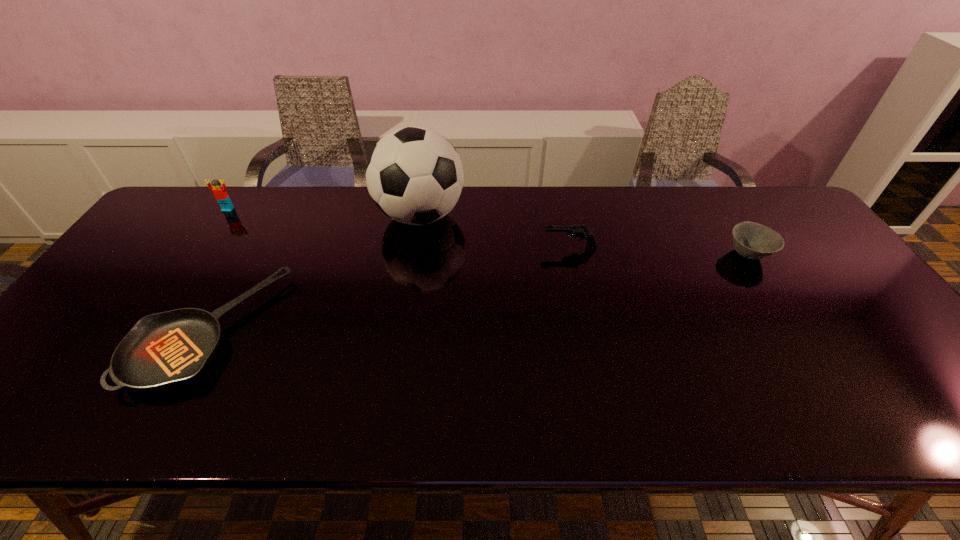
This screenshot has height=540, width=960. Identify the location of free location that satisfies the following two spatial constraints: 1. at the end of the barrel of the fourth tallest object; 2. on the right side of the gun. (571, 254).

The height and width of the screenshot is (540, 960). Identify the location of free space that satisfies the following two spatial constraints: 1. at the end of the barrel of the gun; 2. on the back side of the bowl. (x=571, y=254).

Find the location of a particular element. Image resolution: width=960 pixels, height=540 pixels. vacant space that satisfies the following two spatial constraints: 1. on the face of the Lego; 2. on the right side of the rightmost object is located at coordinates (198, 254).